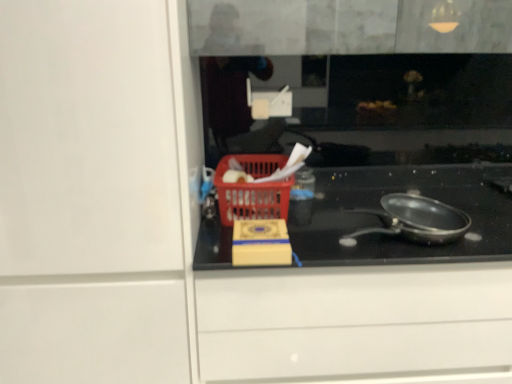
Question: Does shiny black frying pan at center have a greater height compared to red plastic basket at center?

Choices:
 (A) no
 (B) yes

Answer: (A)

Question: Is shiny black frying pan at center turned away from red plastic basket at center?

Choices:
 (A) no
 (B) yes

Answer: (A)

Question: Considering the relative positions of shiny black frying pan at center and red plastic basket at center in the image provided, is shiny black frying pan at center to the left of red plastic basket at center from the viewer's perspective?

Choices:
 (A) no
 (B) yes

Answer: (A)

Question: Is shiny black frying pan at center placed right next to red plastic basket at center?

Choices:
 (A) no
 (B) yes

Answer: (A)

Question: Are shiny black frying pan at center and red plastic basket at center far apart?

Choices:
 (A) yes
 (B) no

Answer: (B)

Question: Does shiny black frying pan at center have a smaller size compared to red plastic basket at center?

Choices:
 (A) no
 (B) yes

Answer: (B)

Question: Does black glass cooktop at center have a greater width compared to red plastic basket at center?

Choices:
 (A) no
 (B) yes

Answer: (B)

Question: From a real-world perspective, is black glass cooktop at center physically below red plastic basket at center?

Choices:
 (A) yes
 (B) no

Answer: (A)

Question: Is black glass cooktop at center positioned with its back to red plastic basket at center?

Choices:
 (A) no
 (B) yes

Answer: (A)

Question: Is black glass cooktop at center in contact with red plastic basket at center?

Choices:
 (A) no
 (B) yes

Answer: (A)

Question: Is black glass cooktop at center oriented towards red plastic basket at center?

Choices:
 (A) yes
 (B) no

Answer: (B)

Question: Would you say black glass cooktop at center is a long distance from red plastic basket at center?

Choices:
 (A) yes
 (B) no

Answer: (B)

Question: Is shiny black frying pan at center in front of black glass cooktop at center?

Choices:
 (A) no
 (B) yes

Answer: (B)